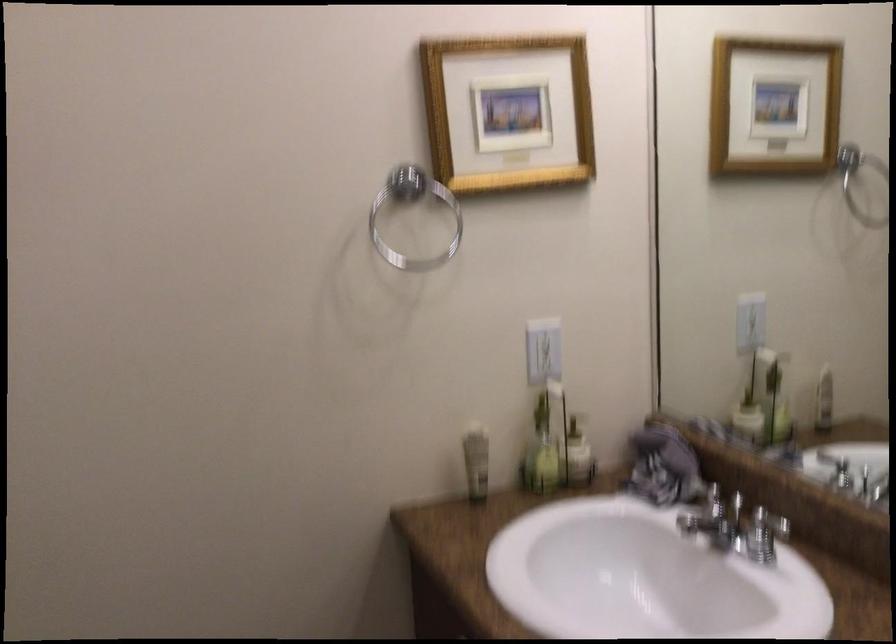
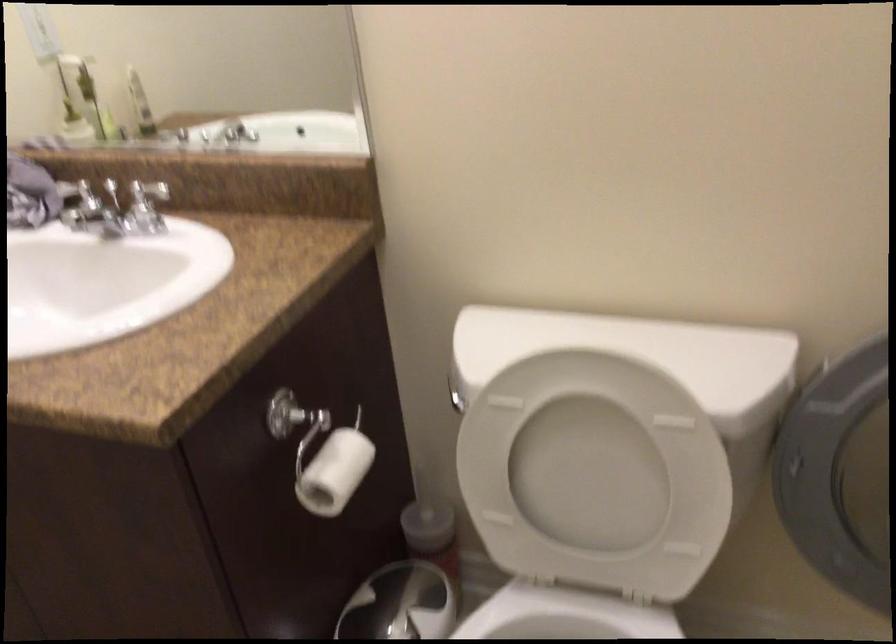
The point at (746,393) is marked in the first image. Where is the corresponding point in the second image?

(70, 111)